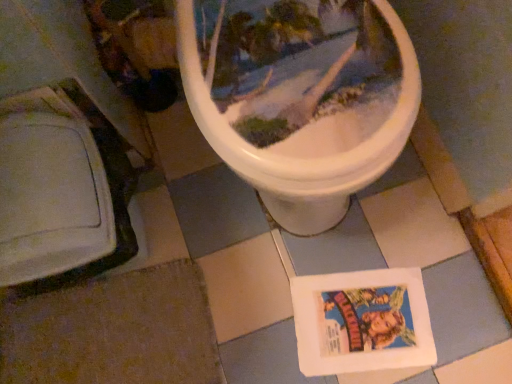
Question: Does brown fabric at lower left have a larger size compared to white paper comic book at lower center?

Choices:
 (A) yes
 (B) no

Answer: (A)

Question: From a real-world perspective, is brown fabric at lower left on top of white paper comic book at lower center?

Choices:
 (A) no
 (B) yes

Answer: (B)

Question: From a real-world perspective, is brown fabric at lower left under white paper comic book at lower center?

Choices:
 (A) no
 (B) yes

Answer: (A)

Question: Is brown fabric at lower left far from white paper comic book at lower center?

Choices:
 (A) no
 (B) yes

Answer: (A)

Question: Does brown fabric at lower left lie behind white paper comic book at lower center?

Choices:
 (A) yes
 (B) no

Answer: (B)

Question: Is brown fabric at lower left turned away from white paper comic book at lower center?

Choices:
 (A) no
 (B) yes

Answer: (A)

Question: Is there a large distance between white paper comic book at lower center and brown fabric at lower left?

Choices:
 (A) no
 (B) yes

Answer: (A)

Question: Can you confirm if white paper comic book at lower center is shorter than brown fabric at lower left?

Choices:
 (A) no
 (B) yes

Answer: (B)

Question: Considering the relative sizes of white paper comic book at lower center and brown fabric at lower left in the image provided, is white paper comic book at lower center bigger than brown fabric at lower left?

Choices:
 (A) no
 (B) yes

Answer: (A)

Question: Is brown fabric at lower left completely or partially inside white paper comic book at lower center?

Choices:
 (A) no
 (B) yes

Answer: (A)

Question: Is white paper comic book at lower center further to camera compared to brown fabric at lower left?

Choices:
 (A) no
 (B) yes

Answer: (B)

Question: Can you confirm if white paper comic book at lower center is wider than brown fabric at lower left?

Choices:
 (A) yes
 (B) no

Answer: (B)

Question: From the image's perspective, relative to brown fabric at lower left, is white paper comic book at lower center above or below?

Choices:
 (A) below
 (B) above

Answer: (B)